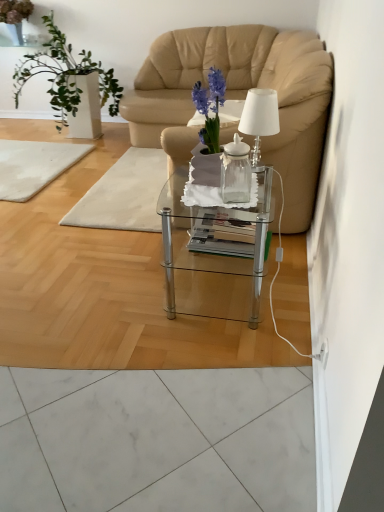
In order to click on vacant area that lies between beige leather armchair at center and clear glass coffee table at center in this screenshot , I will do `click(141, 258)`.